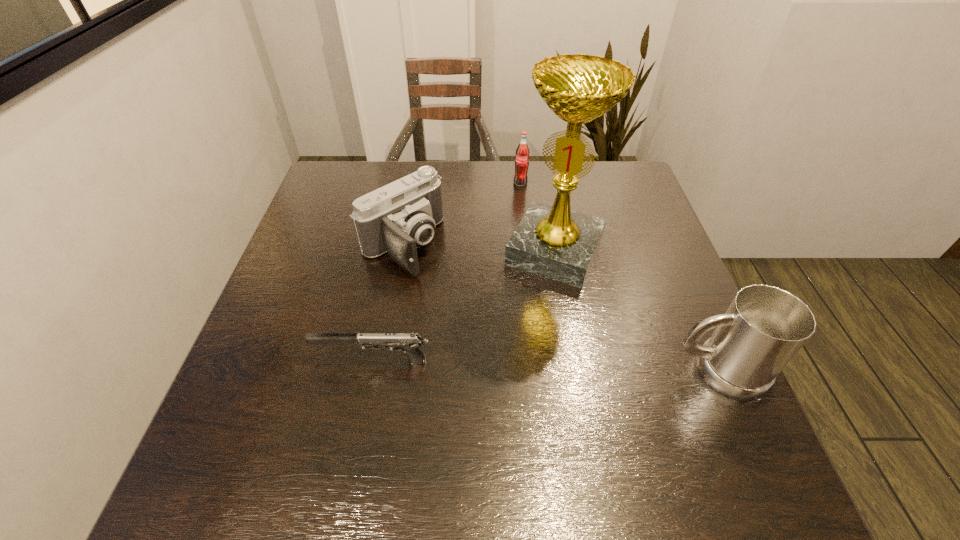
The image size is (960, 540). I want to click on vacant space on the desktop that is between the gun and the mug and is positioned on the label of the farthest object, so click(x=506, y=364).

I want to click on free space on the desktop that is between the shortest object and the rightmost object and is positioned at the front of the camera with an open lens cover, so click(543, 366).

Find the location of a particular element. Image resolution: width=960 pixels, height=540 pixels. free space on the desktop that is between the shortest object and the mug and is positioned on the front-facing side of the award is located at coordinates (499, 364).